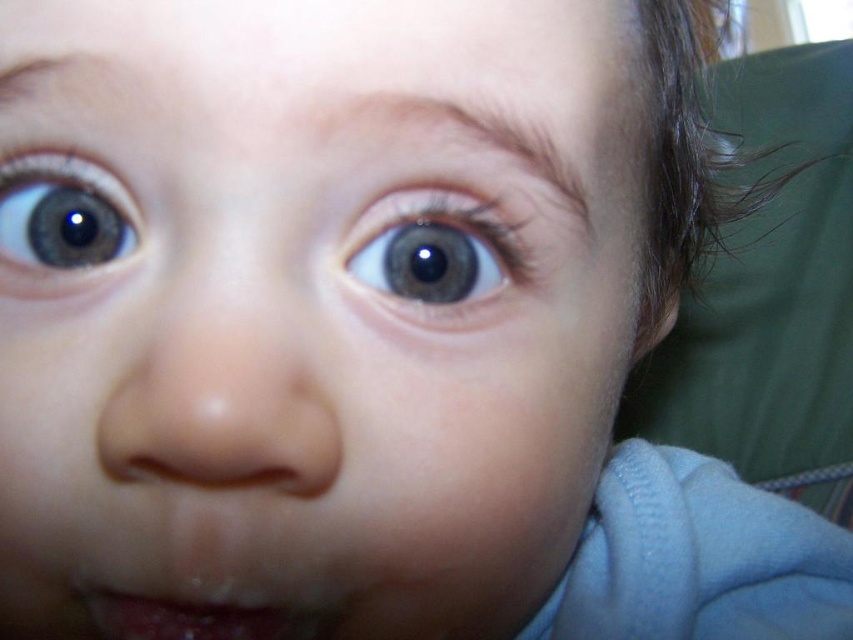
Question: Among these points, which one is nearest to the camera?

Choices:
 (A) (96, 252)
 (B) (279, 612)

Answer: (B)

Question: Can you confirm if matte brown eye at upper left is smaller than dry matte lips at lower center?

Choices:
 (A) no
 (B) yes

Answer: (B)

Question: Which object is the farthest from the dry matte lips at lower center?

Choices:
 (A) blue glossy eye at center
 (B) matte brown eye at upper left

Answer: (A)

Question: Can you confirm if blue glossy eye at center is bigger than dry matte lips at lower center?

Choices:
 (A) yes
 (B) no

Answer: (A)

Question: Does matte brown eye at upper left appear on the left side of dry matte lips at lower center?

Choices:
 (A) no
 (B) yes

Answer: (B)

Question: Which object appears farthest from the camera in this image?

Choices:
 (A) matte brown eye at upper left
 (B) dry matte lips at lower center

Answer: (A)